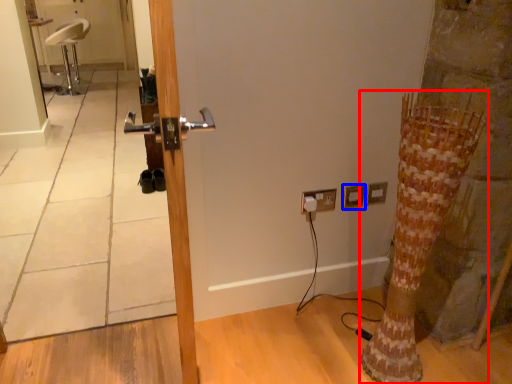
Question: Among these objects, which one is nearest to the camera, tree trunk (highlighted by a red box) or electric outlet (highlighted by a blue box)?

Choices:
 (A) tree trunk
 (B) electric outlet

Answer: (A)